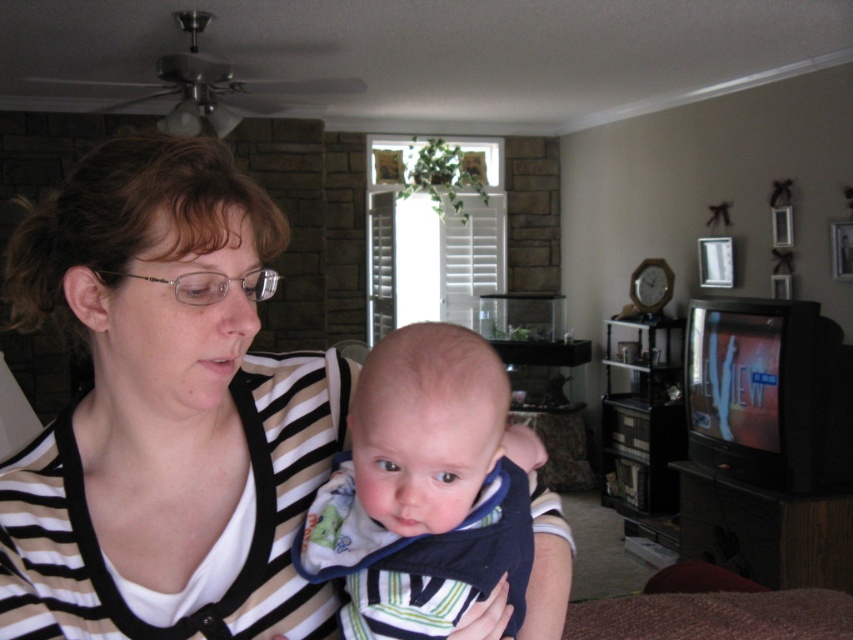
Who is positioned more to the right, striped fabric shirt at center or striped fabric baby at center?

Positioned to the right is striped fabric baby at center.

Can you confirm if striped fabric shirt at center is thinner than striped fabric baby at center?

In fact, striped fabric shirt at center might be wider than striped fabric baby at center.

Who is more forward, (223,296) or (526,497)?

Positioned in front is point (223,296).

Image resolution: width=853 pixels, height=640 pixels. Identify the location of striped fabric shirt at center. (165, 412).